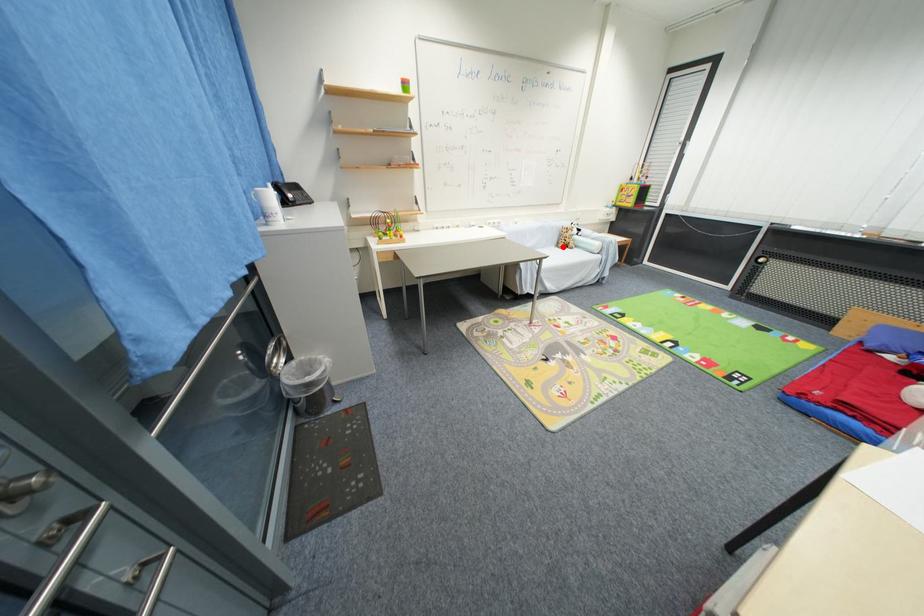
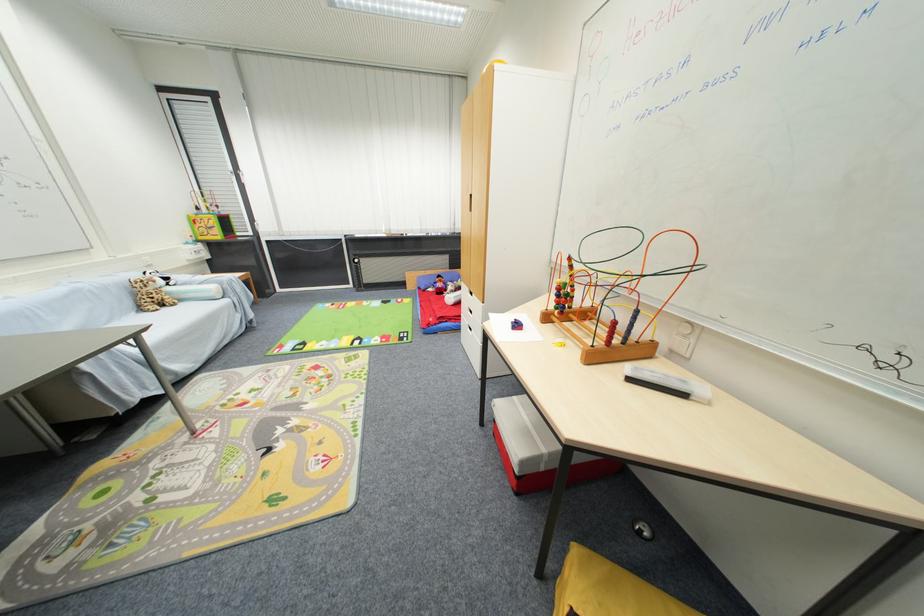
Question: I am providing you with two images of the same scene from different viewpoints. In image1, a red point is highlighted. Considering the same 3D point in image2, which of the following is correct?

Choices:
 (A) It is closer
 (B) It is farther

Answer: (A)